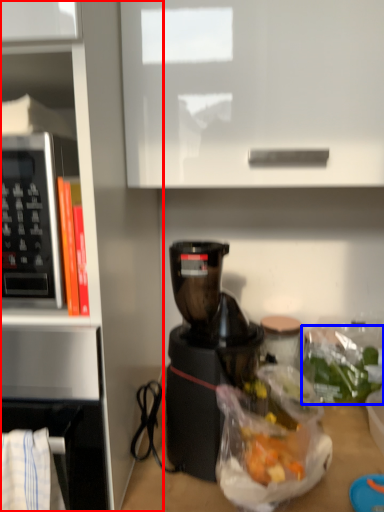
Question: Which point is closer to the camera, bookshelf (highlighted by a red box) or food (highlighted by a blue box)?

Choices:
 (A) bookshelf
 (B) food

Answer: (A)